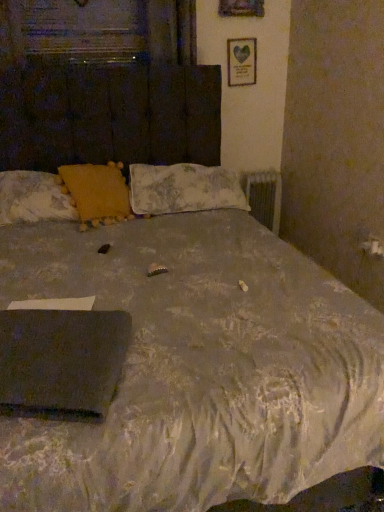
Question: Is white paper at upper center a part of yellow fabric pillow at upper left, positioned as the first pillow in left-to-right order?

Choices:
 (A) no
 (B) yes

Answer: (A)

Question: Is yellow fabric pillow at upper left, positioned as the first pillow in left-to-right order, facing away from white paper at upper center?

Choices:
 (A) no
 (B) yes

Answer: (A)

Question: Is yellow fabric pillow at upper left, positioned as the first pillow in left-to-right order, not near white paper at upper center?

Choices:
 (A) yes
 (B) no

Answer: (A)

Question: Is yellow fabric pillow at upper left, the 3th pillow in the right-to-left sequence, to the right of white paper at upper center from the viewer's perspective?

Choices:
 (A) no
 (B) yes

Answer: (A)

Question: From the image's perspective, does yellow fabric pillow at upper left, positioned as the first pillow in left-to-right order, appear higher than white paper at upper center?

Choices:
 (A) yes
 (B) no

Answer: (B)

Question: Is yellow fabric pillow at upper left, the 3th pillow in the right-to-left sequence, shorter than white paper at upper center?

Choices:
 (A) no
 (B) yes

Answer: (B)

Question: Is black matte laptop at lower left behind fluffy fabric pillow at center, the first pillow viewed from the right?

Choices:
 (A) no
 (B) yes

Answer: (A)

Question: Is black matte laptop at lower left bigger than fluffy fabric pillow at center, the first pillow viewed from the right?

Choices:
 (A) no
 (B) yes

Answer: (A)

Question: From the image's perspective, is black matte laptop at lower left beneath fluffy fabric pillow at center, the 3th pillow in the left-to-right sequence?

Choices:
 (A) yes
 (B) no

Answer: (A)

Question: Does black matte laptop at lower left have a lesser height compared to fluffy fabric pillow at center, the 3th pillow in the left-to-right sequence?

Choices:
 (A) no
 (B) yes

Answer: (B)

Question: Is black matte laptop at lower left oriented towards fluffy fabric pillow at center, the first pillow viewed from the right?

Choices:
 (A) yes
 (B) no

Answer: (B)

Question: Is black matte laptop at lower left positioned beyond the bounds of fluffy fabric pillow at center, the 3th pillow in the left-to-right sequence?

Choices:
 (A) no
 (B) yes

Answer: (B)

Question: Can you confirm if black matte laptop at lower left is wider than metallic silver radiator at right?

Choices:
 (A) yes
 (B) no

Answer: (A)